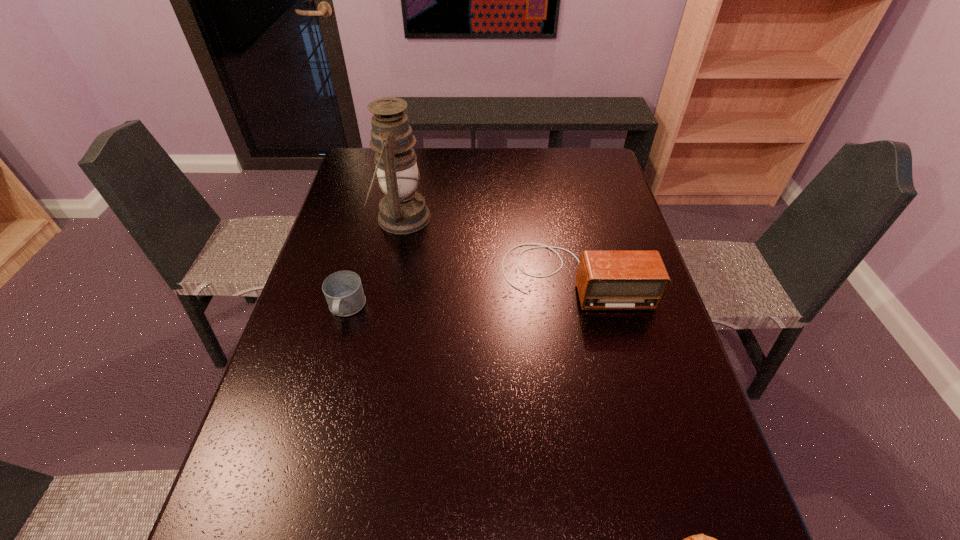
Where is `vacant point at the far edge`? The width and height of the screenshot is (960, 540). vacant point at the far edge is located at coordinates (429, 170).

The width and height of the screenshot is (960, 540). What are the coordinates of `vacant position at the left edge of the desktop` in the screenshot? It's located at [x=307, y=472].

You are a GUI agent. You are given a task and a screenshot of the screen. Output one action in this format:
    pyautogui.click(x=<x>, y=<y>)
    Task: Click on the blank space at the right edge
    The image size is (960, 540).
    Given the screenshot: What is the action you would take?
    pyautogui.click(x=643, y=332)

I want to click on vacant space at the far left corner, so click(362, 164).

The width and height of the screenshot is (960, 540). Find the location of `vacant space at the near left corner of the desktop`. vacant space at the near left corner of the desktop is located at coordinates (239, 539).

Identify the location of vacant space at the far right corner of the desktop. (585, 169).

The image size is (960, 540). Identify the location of free spot between the radio receiver and the farthest object. (488, 247).

At what (x,y) coordinates should I click in order to perform the action: click on empty location between the radio receiver and the tallest object. Please return your answer as a coordinate pair (x, y). This screenshot has height=540, width=960. Looking at the image, I should click on (488, 247).

Find the location of a particular element. The image size is (960, 540). free space between the radio receiver and the farthest object is located at coordinates (488, 247).

Locate an element on the screen. The height and width of the screenshot is (540, 960). vacant space that's between the radio receiver and the farthest object is located at coordinates (488, 247).